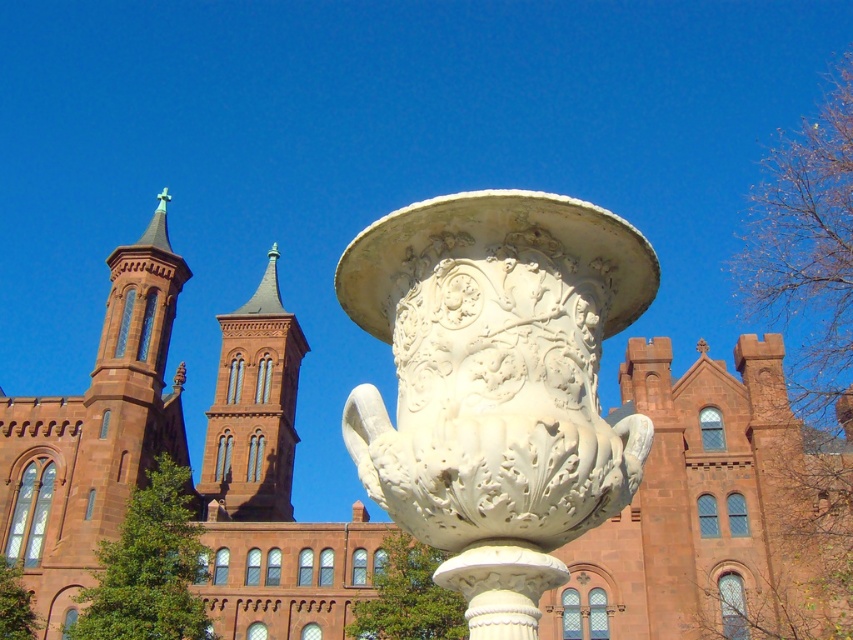
You are standing in front of the grand architectural structure and see two points marked in the image. Which point is closer to you, point (619,284) or point (520,227)?

Answer: Point (520,227) is closer to you because it is less further to the camera than point (619,284).

You are a visitor standing at the entrance of the grand building and want to take a photo of both the white stone vase at center and the red brick tower at center. Given that your camera can capture objects within a 300 feet range, will both subjects be in frame?

The white stone vase at center is 271.72 feet away from the red brick tower at center. Since the distance between them is within the camera range of 300 feet, both subjects can be captured in the photo.

You are standing in front of a large structure and want to take a photo that captures both the matte stone church at center and the large ornate white vase sculpture in the foreground. Since the church is 16.94 meters away from you, will you need to adjust your camera settings to focus on both objects simultaneously?

The matte stone church at center is 16.94 meters from the viewer. To capture both the church and the vase sculpture in focus, ensure your camera has a depth of field that covers this distance. A smaller aperture setting like f16 might help achieve this.